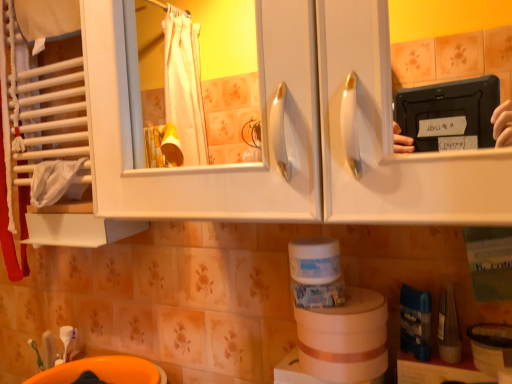
Where is `wooden box at lower right`? The height and width of the screenshot is (384, 512). wooden box at lower right is located at coordinates (438, 370).

Image resolution: width=512 pixels, height=384 pixels. Describe the element at coordinates (104, 371) in the screenshot. I see `orange plastic sink at lower left` at that location.

What do you see at coordinates (314, 260) in the screenshot?
I see `white matte container at center, the 1th toilet paper viewed from the top` at bounding box center [314, 260].

I want to click on wooden box at lower right, so click(x=438, y=370).

Can beige cardboard roll at lower center, which is the 1th toilet paper in bottom-to-top order, be found inside wooden box at lower right?

No, wooden box at lower right does not contain beige cardboard roll at lower center, which is the 1th toilet paper in bottom-to-top order.

In terms of width, does wooden box at lower right look wider or thinner when compared to beige cardboard roll at lower center, which is the 1th toilet paper in bottom-to-top order?

In the image, wooden box at lower right appears to be more narrow than beige cardboard roll at lower center, which is the 1th toilet paper in bottom-to-top order.

From their relative heights in the image, would you say wooden box at lower right is taller or shorter than beige cardboard roll at lower center, the 2th toilet paper viewed from the top?

In the image, wooden box at lower right appears to be taller than beige cardboard roll at lower center, the 2th toilet paper viewed from the top.

Does wooden box at lower right turn towards beige cardboard roll at lower center, the 2th toilet paper viewed from the top?

No, wooden box at lower right is not aimed at beige cardboard roll at lower center, the 2th toilet paper viewed from the top.

Considering the positions of objects orange plastic sink at lower left and white matte container at center, marked as the second toilet paper in a bottom-to-top arrangement, in the image provided, who is more to the left, orange plastic sink at lower left or white matte container at center, marked as the second toilet paper in a bottom-to-top arrangement,?

orange plastic sink at lower left.

Between orange plastic sink at lower left and white matte container at center, the 1th toilet paper viewed from the top, which one has larger width?

Wider between the two is orange plastic sink at lower left.

Is orange plastic sink at lower left bigger or smaller than white matte container at center, marked as the second toilet paper in a bottom-to-top arrangement?

orange plastic sink at lower left is bigger than white matte container at center, marked as the second toilet paper in a bottom-to-top arrangement.

Is orange plastic sink at lower left taller or shorter than white matte container at center, the 1th toilet paper viewed from the top?

orange plastic sink at lower left is taller than white matte container at center, the 1th toilet paper viewed from the top.

Is white matte container at center, marked as the second toilet paper in a bottom-to-top arrangement, in contact with orange plastic sink at lower left?

No, white matte container at center, marked as the second toilet paper in a bottom-to-top arrangement, is not in contact with orange plastic sink at lower left.

Is white matte container at center, marked as the second toilet paper in a bottom-to-top arrangement, positioned beyond the bounds of orange plastic sink at lower left?

white matte container at center, marked as the second toilet paper in a bottom-to-top arrangement, is positioned outside orange plastic sink at lower left.

Is white matte container at center, the 1th toilet paper viewed from the top, shorter than orange plastic sink at lower left?

Yes.

Is white matte container at center, the 1th toilet paper viewed from the top, bigger than orange plastic sink at lower left?

Incorrect, white matte container at center, the 1th toilet paper viewed from the top, is not larger than orange plastic sink at lower left.

Which object is positioned more to the left, white matte container at center, the 1th toilet paper viewed from the top, or wooden box at lower right?

white matte container at center, the 1th toilet paper viewed from the top.

From the image's perspective, who appears lower, white matte container at center, marked as the second toilet paper in a bottom-to-top arrangement, or wooden box at lower right?

wooden box at lower right.

From a real-world perspective, is white matte container at center, the 1th toilet paper viewed from the top, on top of wooden box at lower right?

Yes, from a real-world perspective, white matte container at center, the 1th toilet paper viewed from the top, is on top of wooden box at lower right.

In order to click on toilet paper below the white matte container at center, marked as the second toilet paper in a bottom-to-top arrangement (from a real-world perspective) in this screenshot , I will do pyautogui.click(x=345, y=338).

Considering the sizes of white matte container at center, the 1th toilet paper viewed from the top, and beige cardboard roll at lower center, the 2th toilet paper viewed from the top, in the image, is white matte container at center, the 1th toilet paper viewed from the top, taller or shorter than beige cardboard roll at lower center, the 2th toilet paper viewed from the top,?

white matte container at center, the 1th toilet paper viewed from the top, is shorter than beige cardboard roll at lower center, the 2th toilet paper viewed from the top.

Is the depth of white matte container at center, marked as the second toilet paper in a bottom-to-top arrangement, greater than that of beige cardboard roll at lower center, which is the 1th toilet paper in bottom-to-top order?

Yes, it is behind beige cardboard roll at lower center, which is the 1th toilet paper in bottom-to-top order.

Can you confirm if beige cardboard roll at lower center, the 2th toilet paper viewed from the top, is smaller than orange plastic sink at lower left?

Yes.

Is beige cardboard roll at lower center, the 2th toilet paper viewed from the top, at the left side of orange plastic sink at lower left?

In fact, beige cardboard roll at lower center, the 2th toilet paper viewed from the top, is to the right of orange plastic sink at lower left.

Does beige cardboard roll at lower center, the 2th toilet paper viewed from the top, contain orange plastic sink at lower left?

No.

Who is shorter, wooden box at lower right or white matte container at center, marked as the second toilet paper in a bottom-to-top arrangement?

Standing shorter between the two is white matte container at center, marked as the second toilet paper in a bottom-to-top arrangement.

Considering the sizes of objects wooden box at lower right and white matte container at center, the 1th toilet paper viewed from the top, in the image provided, who is smaller, wooden box at lower right or white matte container at center, the 1th toilet paper viewed from the top,?

white matte container at center, the 1th toilet paper viewed from the top, is smaller.

How far apart are wooden box at lower right and white matte container at center, the 1th toilet paper viewed from the top?

A distance of 9.07 inches exists between wooden box at lower right and white matte container at center, the 1th toilet paper viewed from the top.

Is wooden box at lower right surrounding white matte container at center, the 1th toilet paper viewed from the top?

No, white matte container at center, the 1th toilet paper viewed from the top, is not inside wooden box at lower right.

Where is `the 1st toilet paper above when counting from the wooden box at lower right (from the image's perspective)`? the 1st toilet paper above when counting from the wooden box at lower right (from the image's perspective) is located at coordinates (345, 338).

Locate an element on the screen. Image resolution: width=512 pixels, height=384 pixels. sink lying on the left of white matte container at center, marked as the second toilet paper in a bottom-to-top arrangement is located at coordinates (104, 371).

From the image, which object appears to be farther from orange plastic sink at lower left, wooden box at lower right or white matte container at center, marked as the second toilet paper in a bottom-to-top arrangement?

wooden box at lower right is positioned further to the anchor orange plastic sink at lower left.

In the scene shown: Estimate the real-world distances between objects in this image. Which object is closer to orange plastic sink at lower left, beige cardboard roll at lower center, which is the 1th toilet paper in bottom-to-top order, or white matte container at center, marked as the second toilet paper in a bottom-to-top arrangement?

beige cardboard roll at lower center, which is the 1th toilet paper in bottom-to-top order, is positioned closer to the anchor orange plastic sink at lower left.

From the image, which object appears to be nearer to beige cardboard roll at lower center, the 2th toilet paper viewed from the top, wooden box at lower right or orange plastic sink at lower left?

wooden box at lower right is positioned closer to the anchor beige cardboard roll at lower center, the 2th toilet paper viewed from the top.

Which object lies further to the anchor point white matte container at center, the 1th toilet paper viewed from the top, beige cardboard roll at lower center, which is the 1th toilet paper in bottom-to-top order, or wooden box at lower right?

wooden box at lower right lies further to white matte container at center, the 1th toilet paper viewed from the top, than the other object.

From the image, which object appears to be nearer to white matte container at center, marked as the second toilet paper in a bottom-to-top arrangement, beige cardboard roll at lower center, the 2th toilet paper viewed from the top, or orange plastic sink at lower left?

beige cardboard roll at lower center, the 2th toilet paper viewed from the top.

Consider the image. When comparing their distances from wooden box at lower right, does beige cardboard roll at lower center, which is the 1th toilet paper in bottom-to-top order, or orange plastic sink at lower left seem closer?

beige cardboard roll at lower center, which is the 1th toilet paper in bottom-to-top order, is positioned closer to the anchor wooden box at lower right.

When comparing their distances from white matte container at center, marked as the second toilet paper in a bottom-to-top arrangement, does wooden box at lower right or beige cardboard roll at lower center, which is the 1th toilet paper in bottom-to-top order, seem further?

The object further to white matte container at center, marked as the second toilet paper in a bottom-to-top arrangement, is wooden box at lower right.

In the scene shown: When comparing their distances from white matte container at center, marked as the second toilet paper in a bottom-to-top arrangement, does orange plastic sink at lower left or wooden box at lower right seem further?

orange plastic sink at lower left lies further to white matte container at center, marked as the second toilet paper in a bottom-to-top arrangement, than the other object.

Find the location of a particular element. This screenshot has width=512, height=384. toilet paper between white matte container at center, marked as the second toilet paper in a bottom-to-top arrangement, and wooden box at lower right in the up-down direction is located at coordinates (345, 338).

This screenshot has width=512, height=384. I want to click on toilet paper between orange plastic sink at lower left and beige cardboard roll at lower center, the 2th toilet paper viewed from the top, from left to right, so [x=314, y=260].